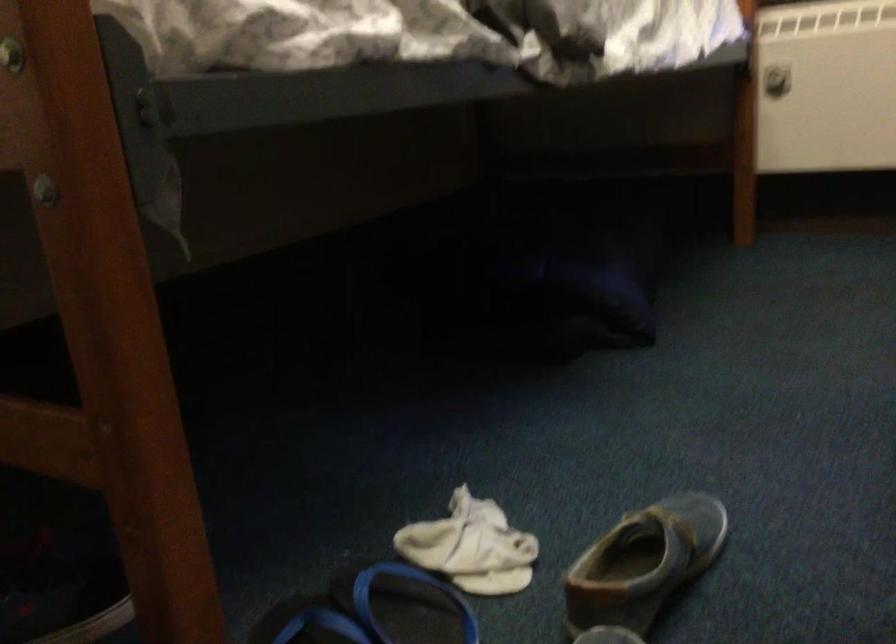
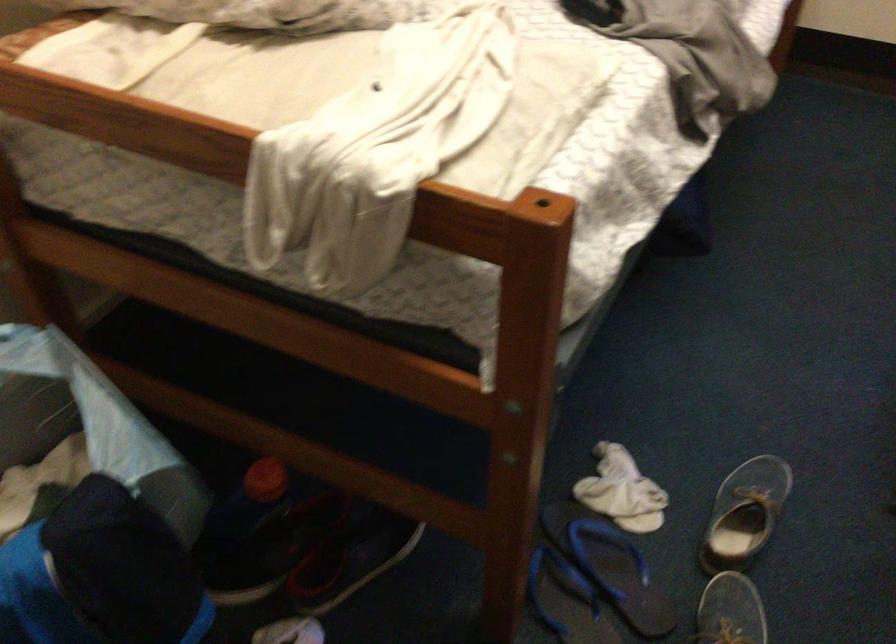
Find the pixel in the second image that matches the point at 642,542 in the first image.

(745, 514)